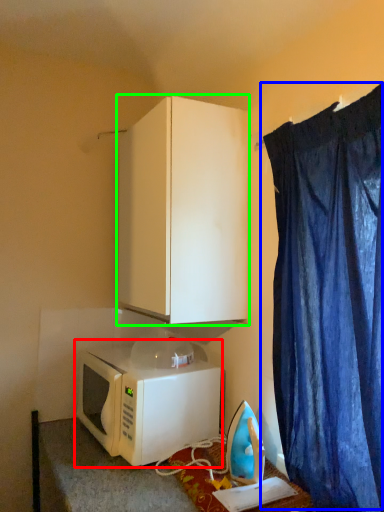
Question: Which object is the closest to the microwave oven (highlighted by a red box)? Choose among these: curtain (highlighted by a blue box) or cabinetry (highlighted by a green box).

Choices:
 (A) curtain
 (B) cabinetry

Answer: (B)